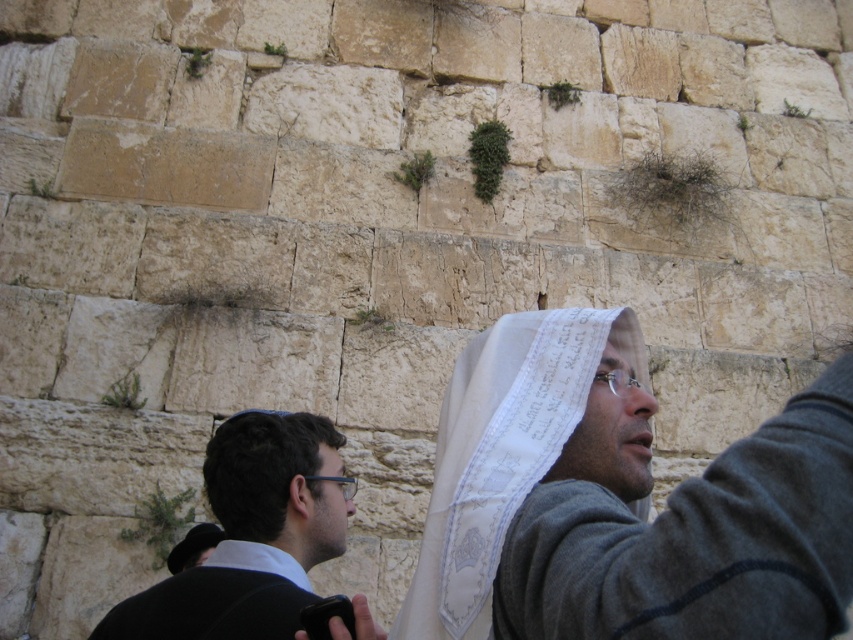
Question: Does white paper at center appear on the right side of white sheer cloth at center?

Choices:
 (A) no
 (B) yes

Answer: (B)

Question: Does white paper at center appear under black fabric at lower left?

Choices:
 (A) yes
 (B) no

Answer: (B)

Question: Which is nearer to the dark brown hair at lower left?

Choices:
 (A) white paper at center
 (B) white sheer cloth at center

Answer: (B)

Question: Which object is positioned closest to the white sheer cloth at center?

Choices:
 (A) white paper at center
 (B) black fabric at lower left

Answer: (A)

Question: Is white paper at center closer to the viewer compared to black fabric at lower left?

Choices:
 (A) no
 (B) yes

Answer: (B)

Question: Which of the following is the farthest from the observer?

Choices:
 (A) dark brown hair at lower left
 (B) white sheer cloth at center
 (C) white paper at center

Answer: (A)